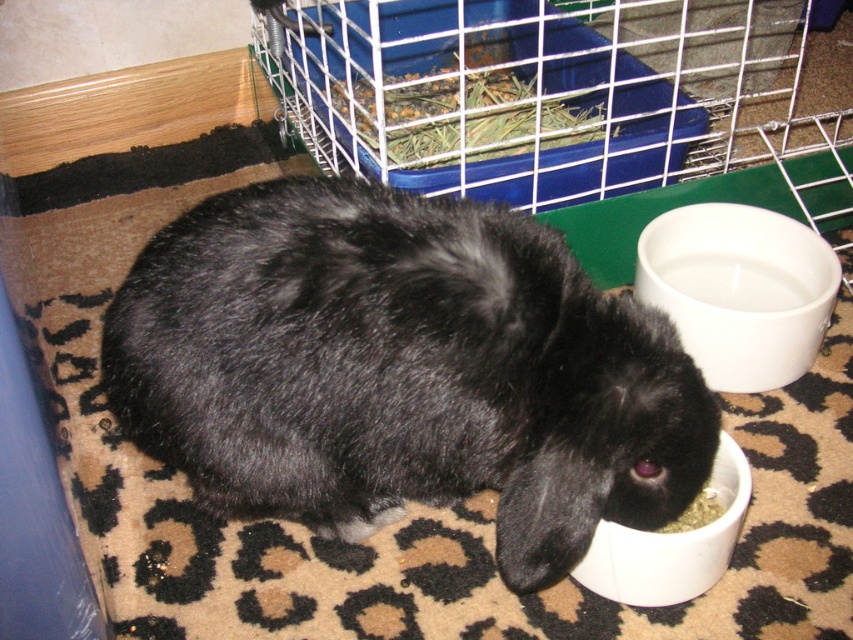
Is black fur rabbit at center smaller than white glossy bowl at lower center?

No, black fur rabbit at center is not smaller than white glossy bowl at lower center.

Can you confirm if black fur rabbit at center is positioned to the left of white glossy bowl at lower center?

Indeed, black fur rabbit at center is positioned on the left side of white glossy bowl at lower center.

Which is in front, point (195, 428) or point (662, 573)?

Point (195, 428) is more forward.

Locate an element on the screen. black fur rabbit at center is located at coordinates (402, 371).

Is the position of white glossy bowl at lower right more distant than that of white glossy bowl at lower center?

Yes, it is.

Is the position of white glossy bowl at lower right less distant than that of white glossy bowl at lower center?

No, it is behind white glossy bowl at lower center.

Identify the location of white glossy bowl at lower right. This screenshot has width=853, height=640. (740, 291).

Is black fur rabbit at center shorter than white glossy bowl at lower right?

No.

Can you confirm if black fur rabbit at center is positioned below white glossy bowl at lower right?

Yes.

Which is behind, point (445, 444) or point (741, 342)?

Positioned behind is point (741, 342).

Where is `black fur rabbit at center`? The width and height of the screenshot is (853, 640). black fur rabbit at center is located at coordinates (402, 371).